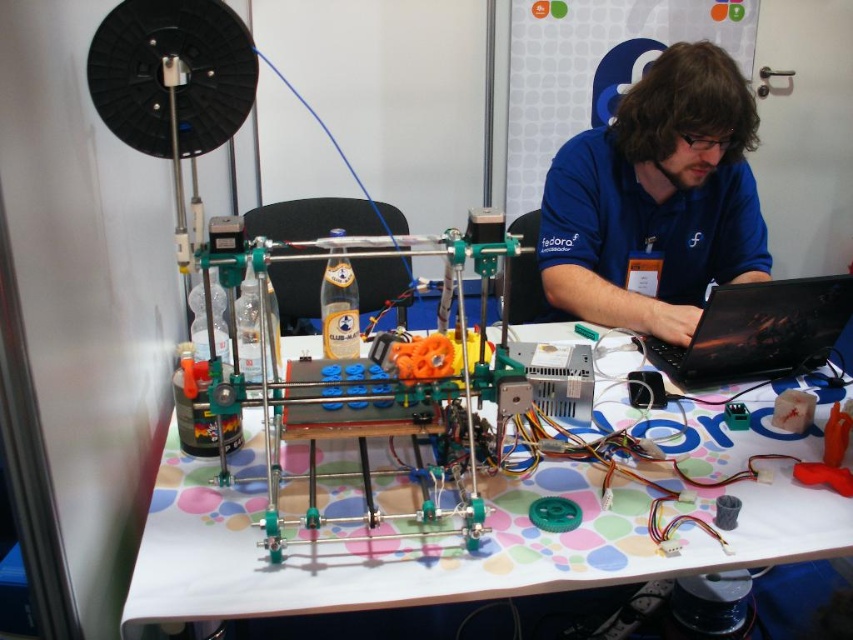
Question: Which object appears closest to the camera in this image?

Choices:
 (A) black glossy laptop at center
 (B) blue fabric shirt at center
 (C) polka dot tablecloth at center

Answer: (C)

Question: Among these points, which one is nearest to the camera?

Choices:
 (A) (566, 252)
 (B) (689, 429)
 (C) (780, 316)

Answer: (B)

Question: Which of these objects is positioned closest to the blue fabric shirt at center?

Choices:
 (A) black glossy laptop at center
 (B) polka dot tablecloth at center

Answer: (A)

Question: Does blue fabric shirt at center come behind black glossy laptop at center?

Choices:
 (A) no
 (B) yes

Answer: (B)

Question: Is blue fabric shirt at center smaller than black glossy laptop at center?

Choices:
 (A) yes
 (B) no

Answer: (B)

Question: Is polka dot tablecloth at center thinner than black glossy laptop at center?

Choices:
 (A) yes
 (B) no

Answer: (B)